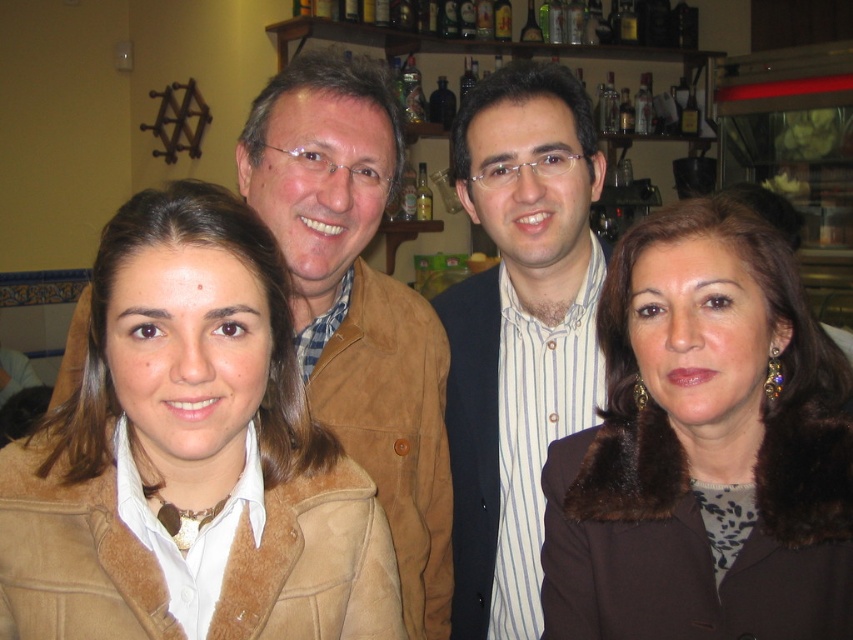
Question: Where is white striped shirt at center located in relation to suede jacket at center in the image?

Choices:
 (A) left
 (B) right

Answer: (B)

Question: Observing the image, what is the correct spatial positioning of suede jacket at left in reference to brown fur coat at right?

Choices:
 (A) above
 (B) below

Answer: (B)

Question: Considering the real-world distances, which object is farthest from the suede jacket at center?

Choices:
 (A) white striped shirt at center
 (B) brown fur coat at right

Answer: (B)

Question: Which point is farther from the camera taking this photo?

Choices:
 (A) (782, 416)
 (B) (519, 531)
 (C) (339, 72)
 (D) (137, 228)

Answer: (B)

Question: Is suede jacket at left wider than brown fur coat at right?

Choices:
 (A) no
 (B) yes

Answer: (B)

Question: Which of these objects is positioned farthest from the suede jacket at center?

Choices:
 (A) suede jacket at left
 (B) brown fur coat at right
 (C) white striped shirt at center

Answer: (B)